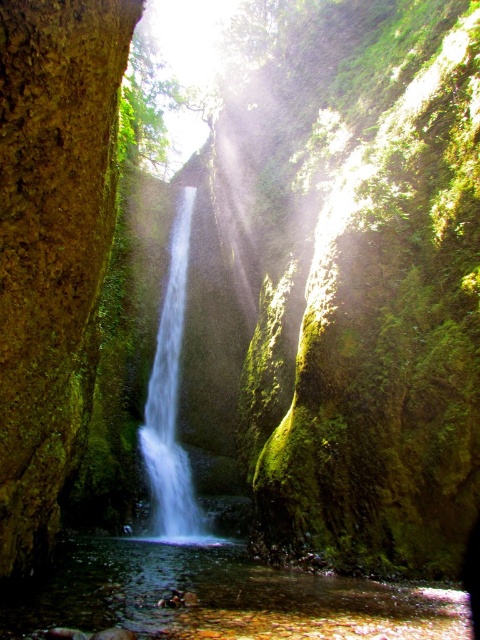
Based on the photo, you are a photographer standing at the base of the canyon. You want to capture a photo of the white smooth waterfall at center and the clear water at center. Which object should you focus on first if you want to include both in your frame?

You should focus on the white smooth waterfall at center first because the clear water at center is below it, so adjusting the focus to the waterfall ensures both are in the frame.

In the scene shown: You are standing at the edge of the canyon looking at the waterfall. There is a point marked at coordinates (224,596). Based on the scene description, where is this point located?

The point is on clear water at center.

You are a hiker who wants to cross the canyon using the pool of clear water at center. The white smooth waterfall at center is blocking your path. Can you walk around the waterfall to reach the other side?

The clear water at center has a larger width than the white smooth waterfall at center, so you can walk around the waterfall along the edges of the clear water at center to reach the other side.